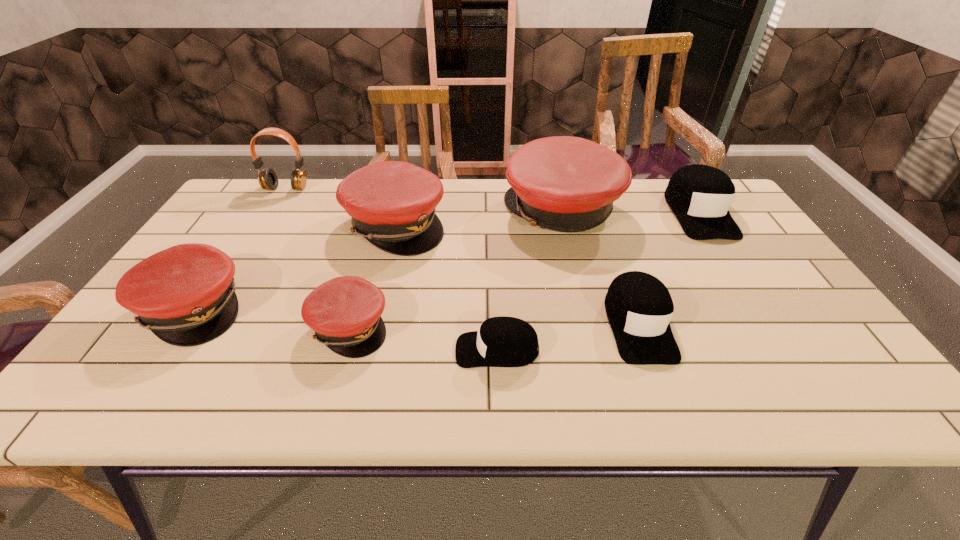
At what (x,y) coordinates should I click in order to perform the action: click on headset. Please return your answer as a coordinate pair (x, y). This screenshot has width=960, height=540. Looking at the image, I should click on (267, 178).

Where is `the rightmost red cap`? This screenshot has width=960, height=540. the rightmost red cap is located at coordinates (563, 183).

Locate an element on the screen. The height and width of the screenshot is (540, 960). the tallest cap is located at coordinates (563, 183).

You are a GUI agent. You are given a task and a screenshot of the screen. Output one action in this format:
    pyautogui.click(x=<x>, y=<y>)
    Task: Click on the third smallest red cap
    The image size is (960, 540).
    Given the screenshot: What is the action you would take?
    pyautogui.click(x=392, y=204)

Find the location of a particular element. the farthest black cap is located at coordinates [x=699, y=195].

Where is `the rightmost object`? the rightmost object is located at coordinates (699, 195).

The image size is (960, 540). In order to click on the leftmost cap in this screenshot , I will do pos(185,295).

The image size is (960, 540). I want to click on the leftmost red cap, so click(185, 295).

The width and height of the screenshot is (960, 540). I want to click on the second black cap from left to right, so click(639, 307).

The image size is (960, 540). I want to click on the smallest red cap, so click(x=345, y=312).